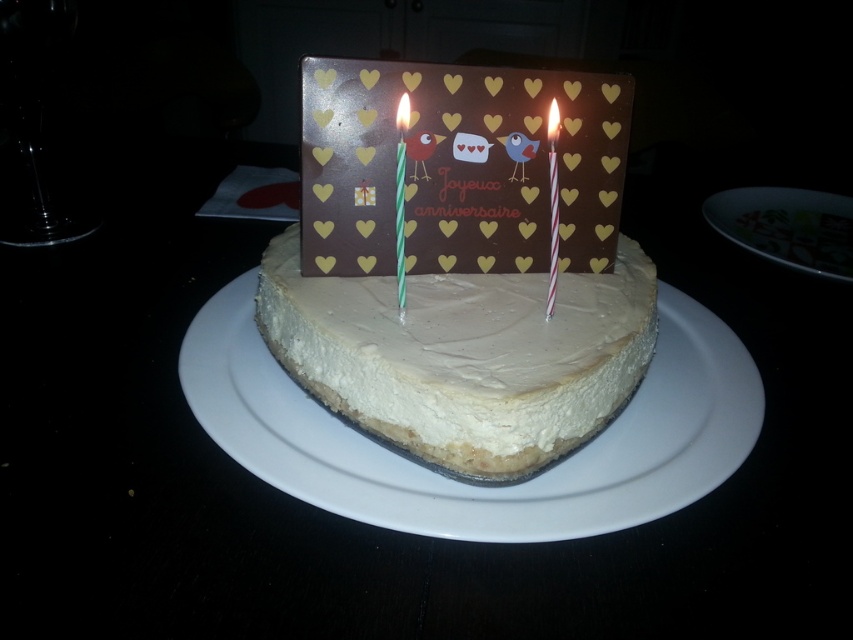
Question: Which of these objects is positioned closest to the white glossy plate at upper right?

Choices:
 (A) brown paper card at center
 (B) white ceramic plate at center
 (C) white striped paper at center

Answer: (B)

Question: Is white cream cheese cake at center wider than brown paper card at center?

Choices:
 (A) yes
 (B) no

Answer: (A)

Question: Is brown paper card at center thinner than white wax candle at upper center?

Choices:
 (A) yes
 (B) no

Answer: (B)

Question: Which object is positioned closest to the white ceramic plate at center?

Choices:
 (A) white cream cheese cake at center
 (B) white glossy plate at upper right

Answer: (A)

Question: Can you confirm if white cream cheese cake at center is bigger than white glossy plate at upper right?

Choices:
 (A) no
 (B) yes

Answer: (B)

Question: Which of these objects is positioned closest to the white wax candle at upper center?

Choices:
 (A) white cream cheese cake at center
 (B) white striped paper at center
 (C) white glossy plate at upper right
 (D) brown paper card at center

Answer: (B)